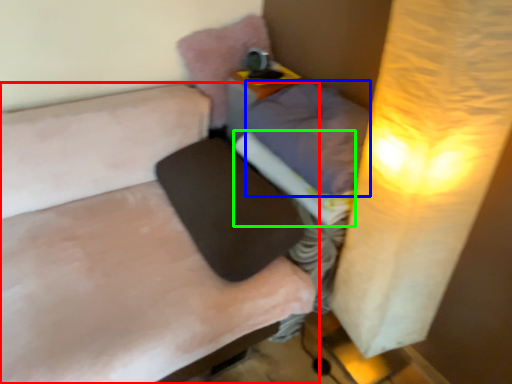
Question: Which object is the farthest from furniture (highlighted by a red box)? Choose among these: pillow (highlighted by a blue box) or sheet (highlighted by a green box).

Choices:
 (A) pillow
 (B) sheet

Answer: (A)